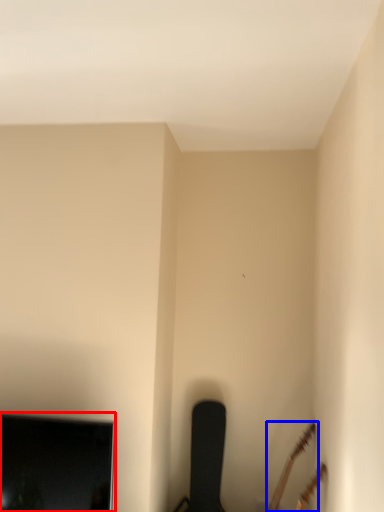
Question: Which object is further to the camera taking this photo, television (highlighted by a red box) or guitar (highlighted by a blue box)?

Choices:
 (A) television
 (B) guitar

Answer: (B)